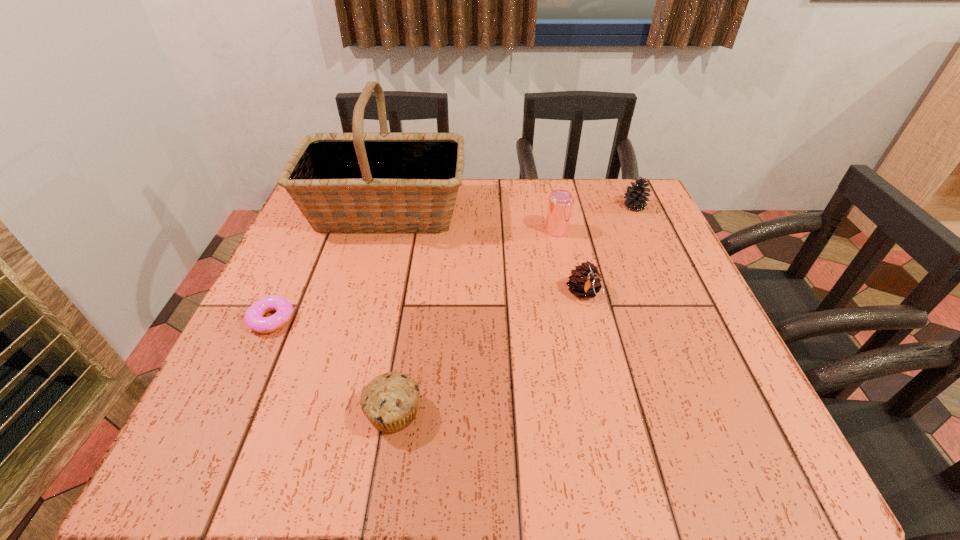
Identify the location of blank space located with a leaf charm attached to the left pinecone. (619, 443).

What are the coordinates of `free space located 0.140m on the right of the muffin` in the screenshot? It's located at (507, 413).

At what (x,y) coordinates should I click in order to perform the action: click on free space located on the back of the shortest object. Please return your answer as a coordinate pair (x, y). Looking at the image, I should click on (296, 267).

Find the location of `basket that is at the far edge`. basket that is at the far edge is located at coordinates (343, 183).

At what (x,y) coordinates should I click in order to perform the action: click on beer can that is at the far edge. Please return your answer as a coordinate pair (x, y). Looking at the image, I should click on (560, 201).

At what (x,y) coordinates should I click in order to perform the action: click on pinecone positioned at the far edge. Please return your answer as a coordinate pair (x, y). Image resolution: width=960 pixels, height=540 pixels. Looking at the image, I should click on (635, 197).

Where is `object positioned at the near edge`? object positioned at the near edge is located at coordinates (390, 401).

Identify the location of basket at the left edge. This screenshot has height=540, width=960. (343, 183).

Where is `doughnut situated at the left edge`? This screenshot has width=960, height=540. doughnut situated at the left edge is located at coordinates (254, 319).

In order to click on object located in the right edge section of the desktop in this screenshot , I will do `click(635, 197)`.